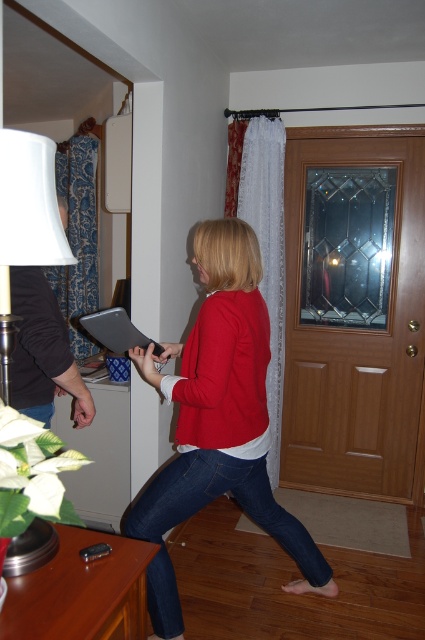
You are standing in the living room and want to place a new lamp on the table. The table is located at point 0.325, 0.066. Is the white fabric lampshade at left already occupying that spot?

The white fabric lampshade at left is already positioned at point (28, 208), so the table is already occupied by the white fabric lampshade at left.

You are a delivery person who needs to hand over a package to the person holding the tablet. The package is too large to fit in your hands, so you need to place it on an available surface. Which object between the white fabric lampshade at left and the matte black clipboard at center is closer to the person holding the tablet?

The white fabric lampshade at left is closer to the person holding the tablet because it is in front of the matte black clipboard at center, making it the nearest available surface.

You are a delivery person who needs to place a small package between the matte red sweater at center and the matte black clipboard at center. The package measures 12 inches in length. Can you fit it between them without moving either object?

The distance between the matte red sweater at center and the matte black clipboard at center is 13.84 inches. Since the package is 12 inches long, it can fit between them as there is enough space.